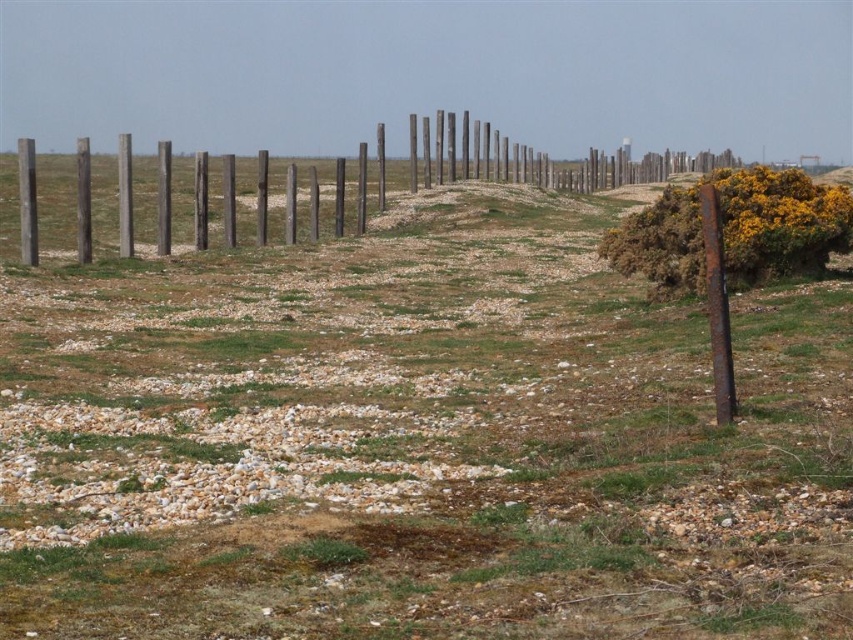
Question: Which of the following is the closest to the observer?

Choices:
 (A) weathered wood fence at center
 (B) rusty metal post at right

Answer: (B)

Question: Which point is closer to the camera?

Choices:
 (A) rusty metal post at right
 (B) weathered wood fence at center

Answer: (A)

Question: Does weathered wood fence at center have a smaller size compared to rusty metal post at right?

Choices:
 (A) no
 (B) yes

Answer: (A)

Question: Does weathered wood fence at center come in front of rusty metal post at right?

Choices:
 (A) yes
 (B) no

Answer: (B)

Question: Does weathered wood fence at center appear on the left side of rusty metal post at right?

Choices:
 (A) no
 (B) yes

Answer: (B)